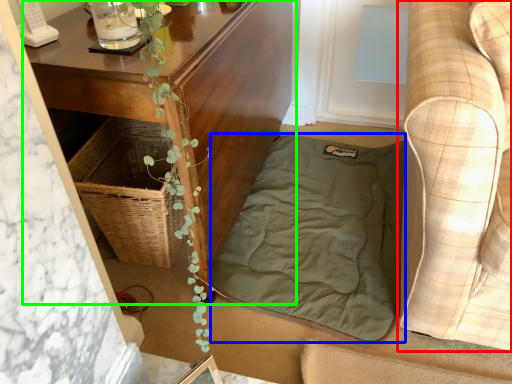
Question: Which is farther away from studio couch (highlighted by a red box)? blanket (highlighted by a blue box) or table (highlighted by a green box)?

Choices:
 (A) blanket
 (B) table

Answer: (B)